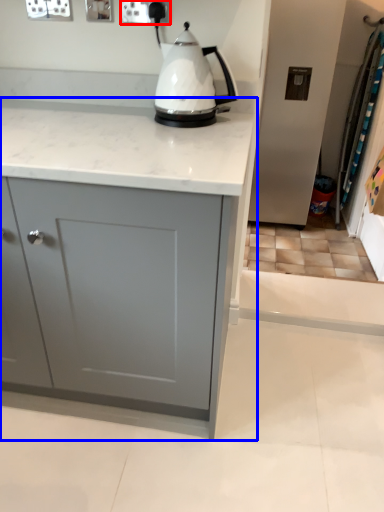
Question: Which point is closer to the camera, electric outlet (highlighted by a red box) or cabinetry (highlighted by a blue box)?

Choices:
 (A) electric outlet
 (B) cabinetry

Answer: (B)